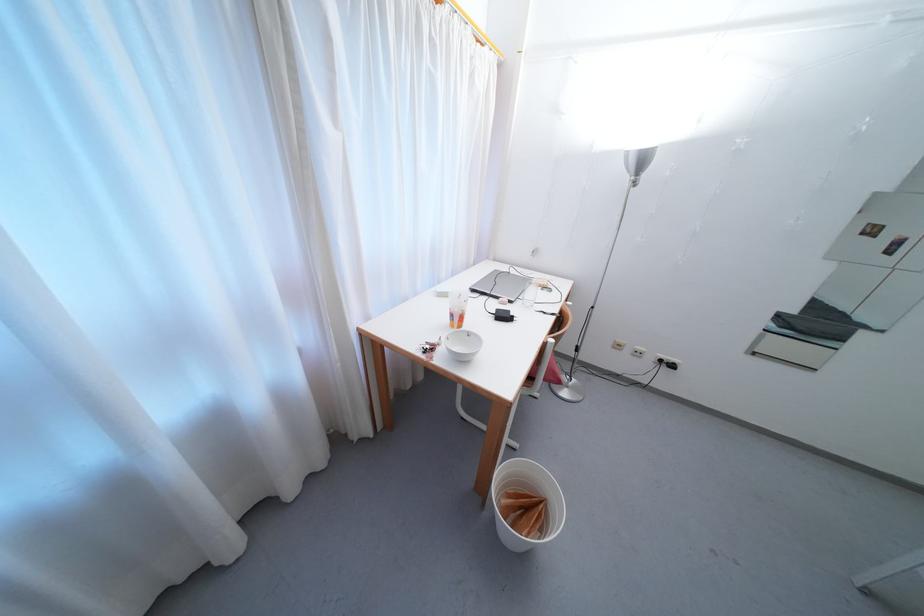
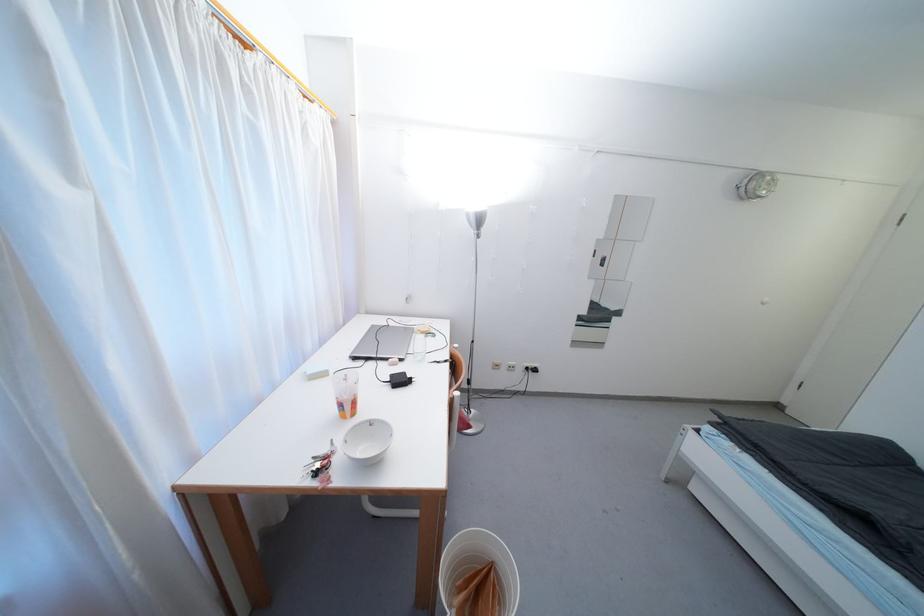
Locate, in the second image, the point that corresponds to point 432,349 in the first image.

(322, 468)